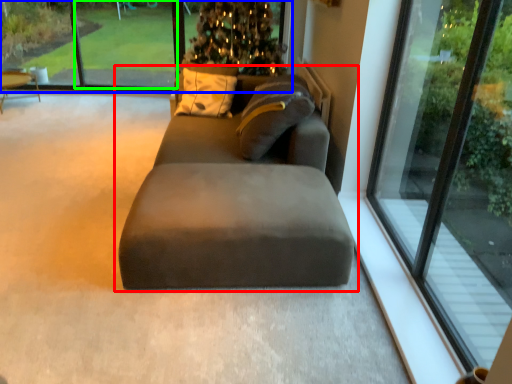
Question: Which is nearer to the studio couch (highlighted by a red box)? window screen (highlighted by a blue box) or window screen (highlighted by a green box).

Choices:
 (A) window screen
 (B) window screen

Answer: (B)